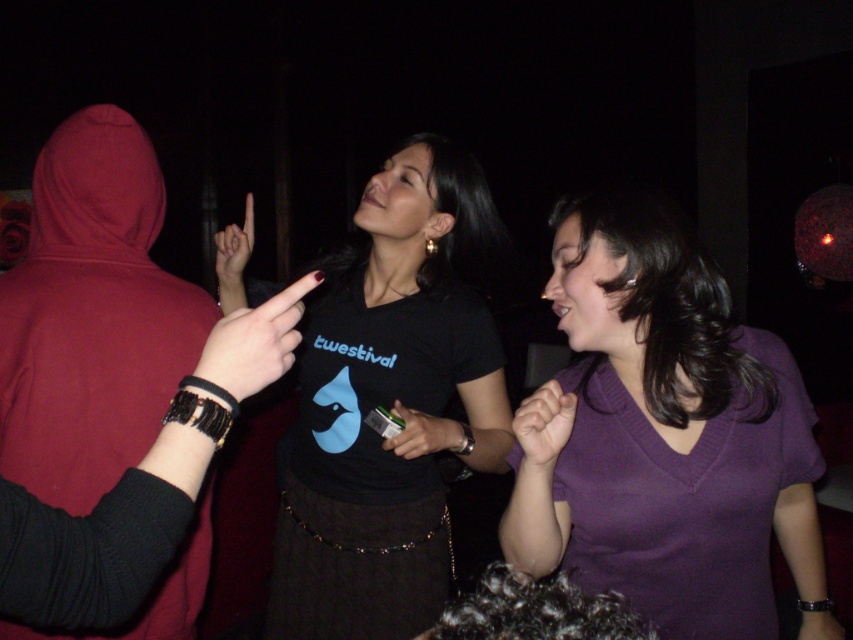
You are at a social event and see two items at the center of the scene. The purple matte shirt at center and the black leather finger at center. Which one is positioned higher up?

The black leather finger at center is positioned higher up than the purple matte shirt at center.

You are a photographer trying to capture a group photo of the purple matte shirt at center and the black leather finger at center. The camera can only focus on objects wider than 10 cm. Can both subjects be in focus?

The purple matte shirt at center is wider than the black leather finger at center. Since the purple matte shirt at center is wider than 10 cm, it will be in focus. However, the black leather finger at center may be narrower than 10 cm and might not be in focus.

You are a photographer adjusting the camera focus. The camera is currently focused on the purple matte shirt at center. If you want to focus on the matte black finger at upper center instead, should you adjust the focus to be closer or farther away?

The purple matte shirt at center is much taller than the matte black finger at upper center. To focus on the matte black finger at upper center, you should adjust the focus to be closer since it is shorter and closer to the camera.